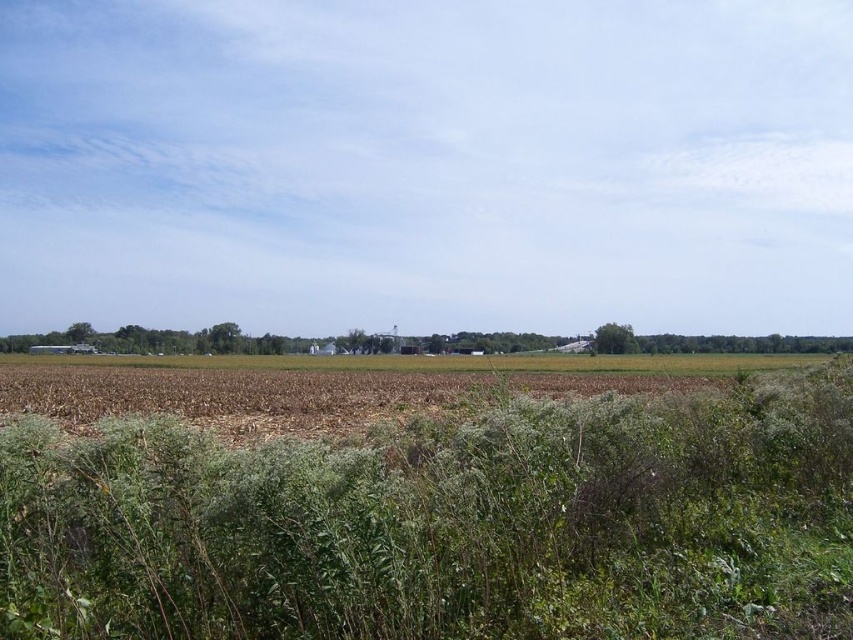
Does green grassy vegetation at center have a lesser height compared to green grass at center?

Correct, green grassy vegetation at center is not as tall as green grass at center.

Find the location of `green grassy vegetation at center`. green grassy vegetation at center is located at coordinates (445, 524).